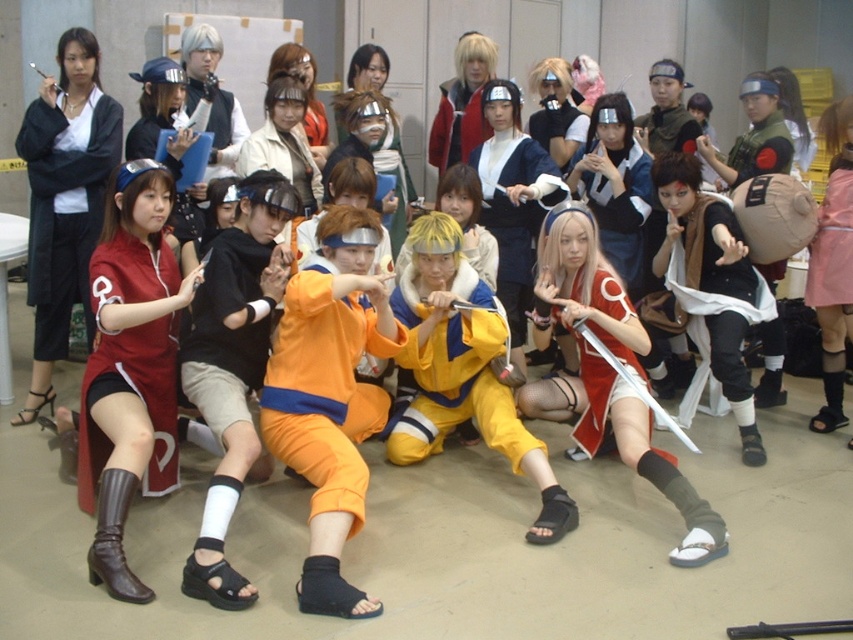
You are a photographer at a cosplay event. You need to position yourself so that the orange fabric pants at center and the matte red cosplay outfit at left are both in your camera frame. Based on their positions, which object should you adjust your camera angle to focus on first?

The orange fabric pants at center are to the right of the matte red cosplay outfit at left. To capture both in the frame, adjust your camera angle to first focus on the matte red cosplay outfit at left since it is positioned further to the left and the orange fabric pants at center are to its right.